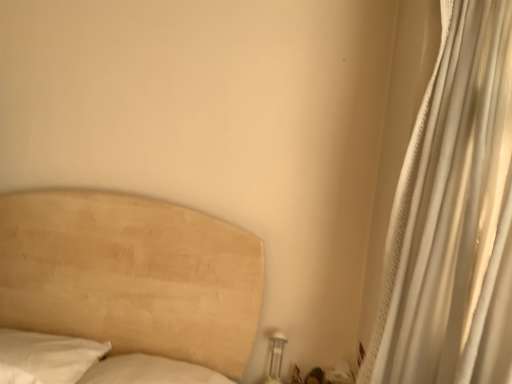
Question: Does white glossy table lamp at lower right come in front of white textured curtain at right?

Choices:
 (A) no
 (B) yes

Answer: (A)

Question: Is white glossy table lamp at lower right at the left side of white textured curtain at right?

Choices:
 (A) no
 (B) yes

Answer: (B)

Question: Would you say white glossy table lamp at lower right contains white textured curtain at right?

Choices:
 (A) yes
 (B) no

Answer: (B)

Question: From the image's perspective, is white glossy table lamp at lower right on white textured curtain at right?

Choices:
 (A) no
 (B) yes

Answer: (A)

Question: From the image's perspective, is white glossy table lamp at lower right under white textured curtain at right?

Choices:
 (A) yes
 (B) no

Answer: (A)

Question: Is white glossy table lamp at lower right oriented away from white textured curtain at right?

Choices:
 (A) yes
 (B) no

Answer: (B)

Question: Is white textured curtain at right positioned behind white glossy table lamp at lower right?

Choices:
 (A) no
 (B) yes

Answer: (A)

Question: From a real-world perspective, is white textured curtain at right on top of white glossy table lamp at lower right?

Choices:
 (A) yes
 (B) no

Answer: (A)

Question: Is white textured curtain at right touching white glossy table lamp at lower right?

Choices:
 (A) yes
 (B) no

Answer: (B)

Question: Considering the relative sizes of white textured curtain at right and white glossy table lamp at lower right in the image provided, is white textured curtain at right smaller than white glossy table lamp at lower right?

Choices:
 (A) no
 (B) yes

Answer: (A)

Question: Is white textured curtain at right outside of white glossy table lamp at lower right?

Choices:
 (A) yes
 (B) no

Answer: (A)

Question: Is white textured curtain at right not close to white glossy table lamp at lower right?

Choices:
 (A) no
 (B) yes

Answer: (A)

Question: Is white textured curtain at right inside the boundaries of white glossy table lamp at lower right, or outside?

Choices:
 (A) outside
 (B) inside

Answer: (A)